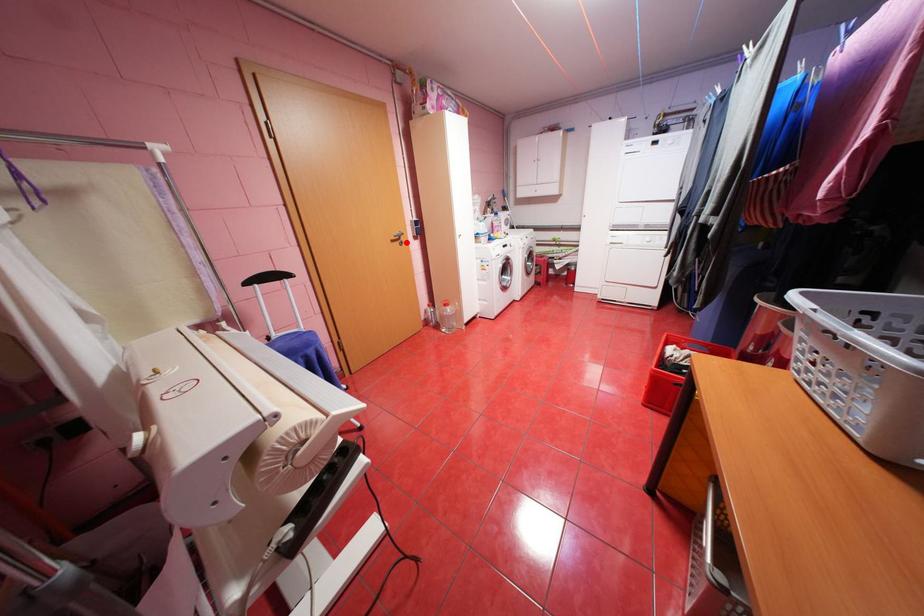
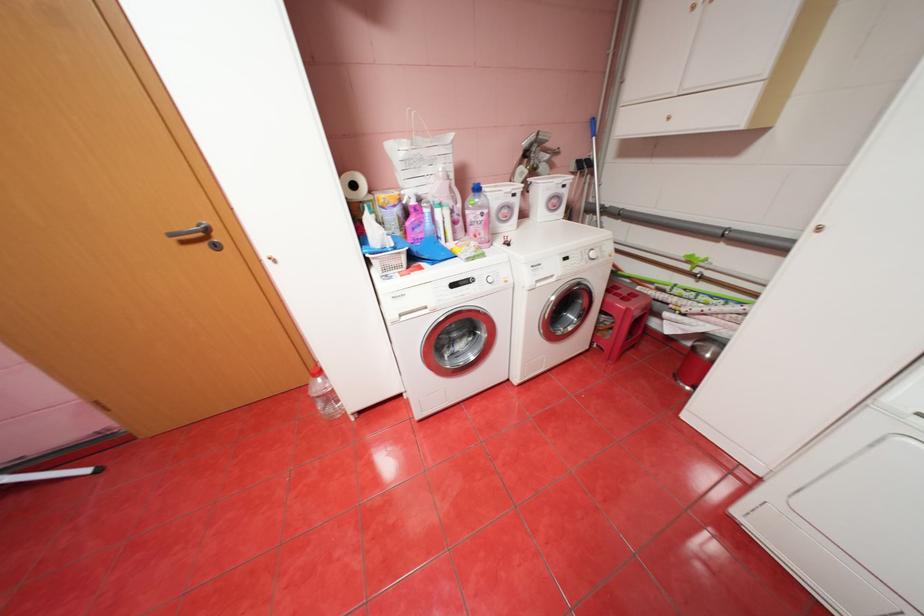
Question: I am providing you with two images of the same scene from different viewpoints. A red point is marked on the first image. Is the red point's position out of view in image 2?

Choices:
 (A) Yes
 (B) No

Answer: (B)